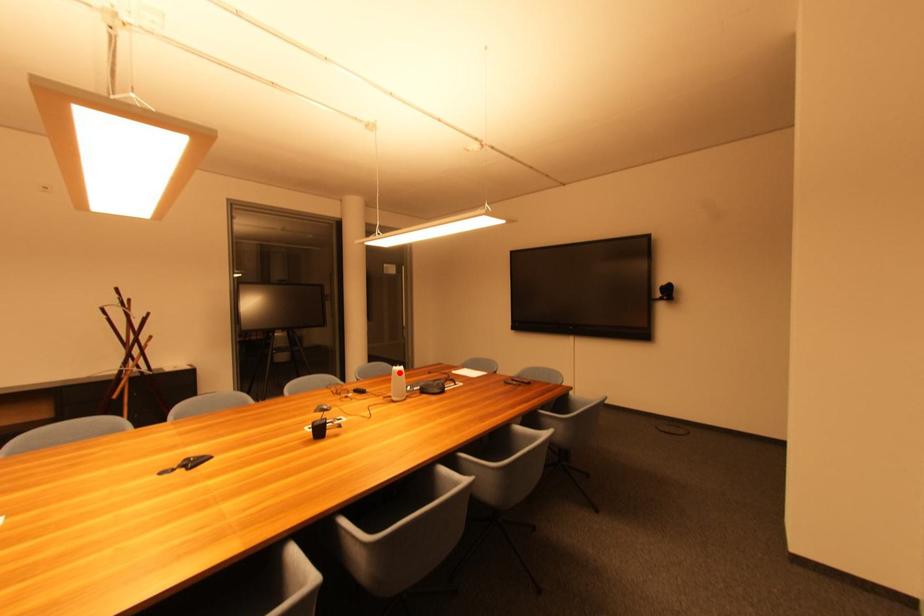
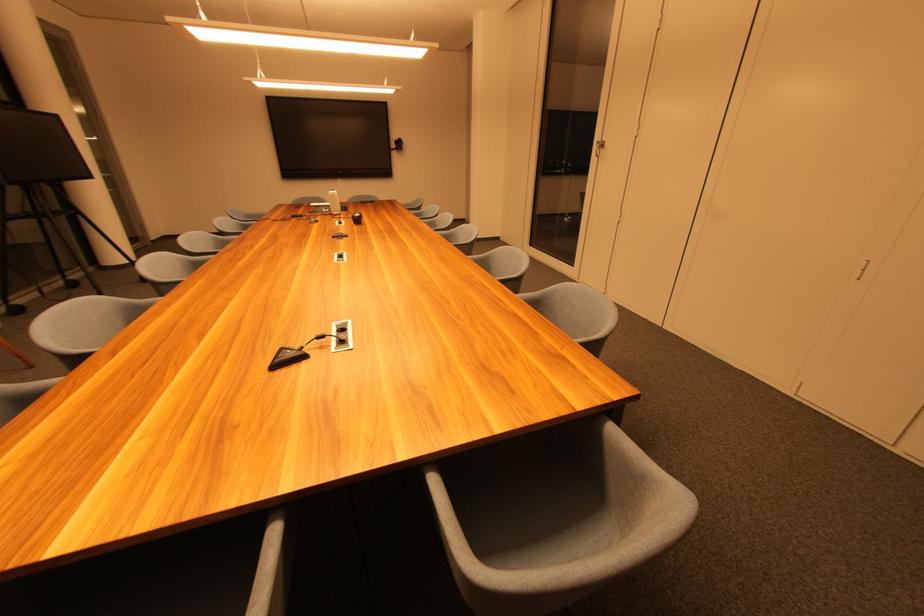
Find the pixel in the second image that matches the highlighted location in the first image.

(337, 196)